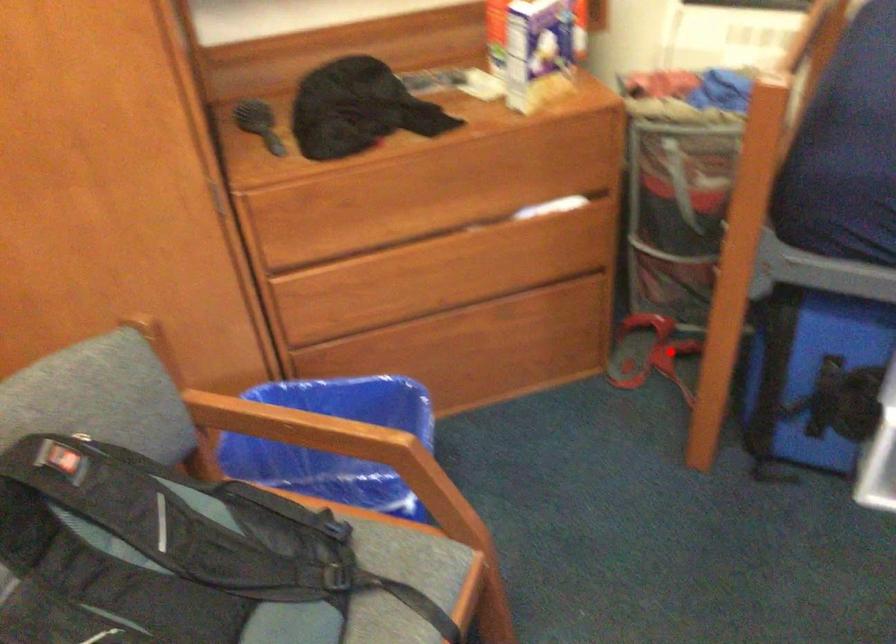
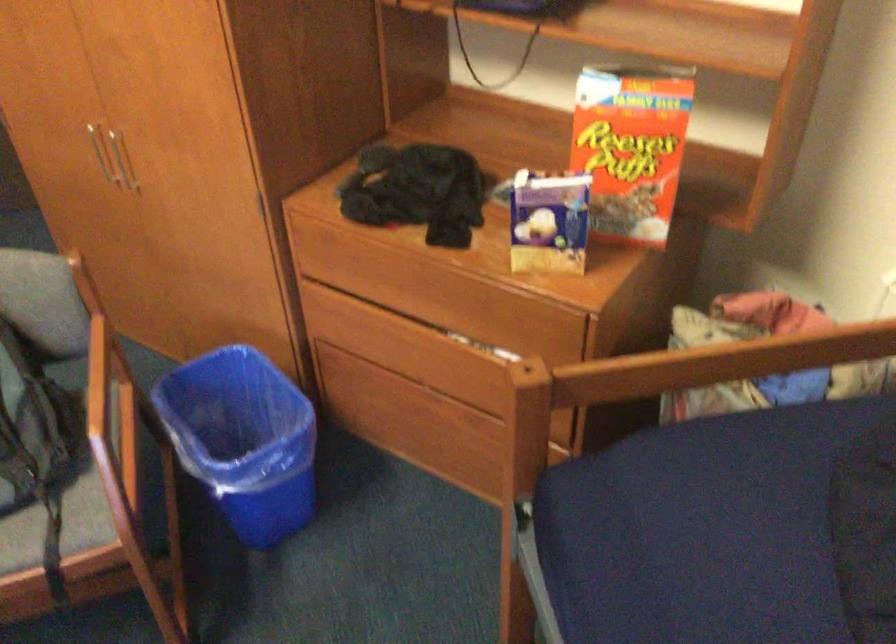
Question: I am providing you with two images of the same scene from different viewpoints. A red point is marked on the first image. Can you still see the location of the red point in image 2?

Choices:
 (A) Yes
 (B) No

Answer: (B)